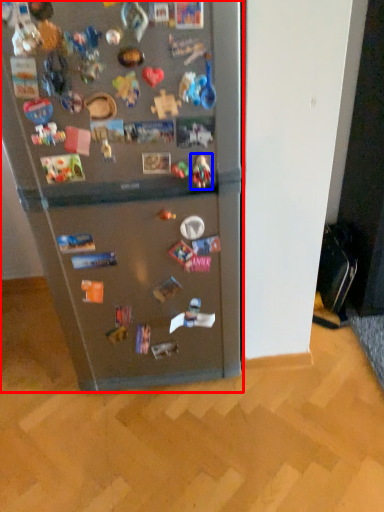
Question: Which of the following is the farthest to the observer, refrigerator (highlighted by a red box) or toy (highlighted by a blue box)?

Choices:
 (A) refrigerator
 (B) toy

Answer: (B)